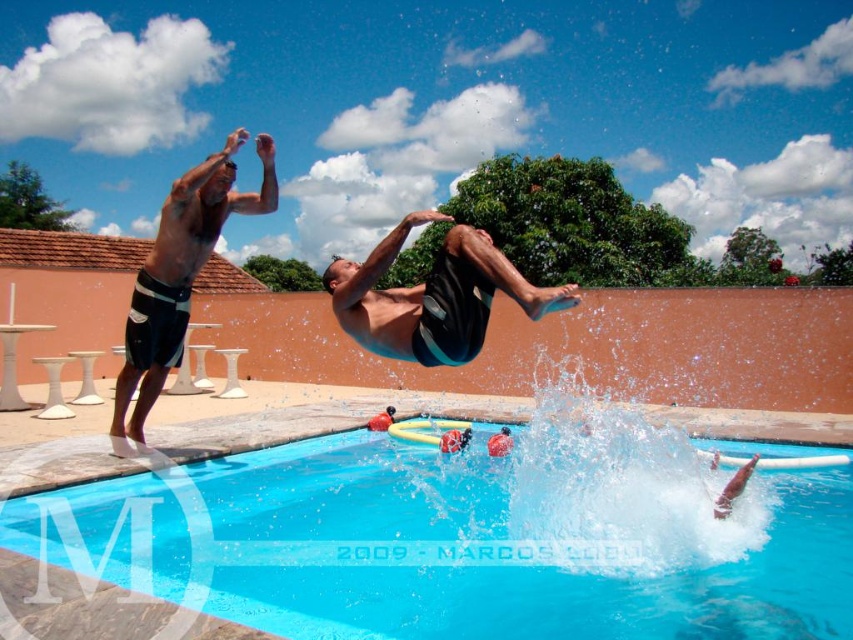
Question: Does black matte shorts at center have a larger size compared to black matte shorts at left?

Choices:
 (A) no
 (B) yes

Answer: (B)

Question: Estimate the real-world distances between objects in this image. Which object is closer to the black matte shorts at center?

Choices:
 (A) black matte shorts at left
 (B) blue smooth water at center

Answer: (B)

Question: Can you confirm if blue smooth water at center is positioned to the right of black matte shorts at left?

Choices:
 (A) yes
 (B) no

Answer: (A)

Question: Estimate the real-world distances between objects in this image. Which object is farther from the black matte shorts at center?

Choices:
 (A) black matte shorts at left
 (B) blue smooth water at center

Answer: (A)

Question: Among these objects, which one is farthest from the camera?

Choices:
 (A) blue smooth water at center
 (B) black matte shorts at left

Answer: (B)

Question: Where is blue smooth water at center located in relation to black matte shorts at center in the image?

Choices:
 (A) above
 (B) below

Answer: (B)